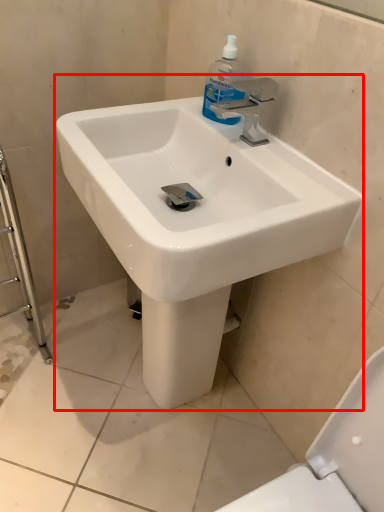
Question: Where is sink (annotated by the red box) located in relation to cleaning product in the image?

Choices:
 (A) right
 (B) left

Answer: (B)